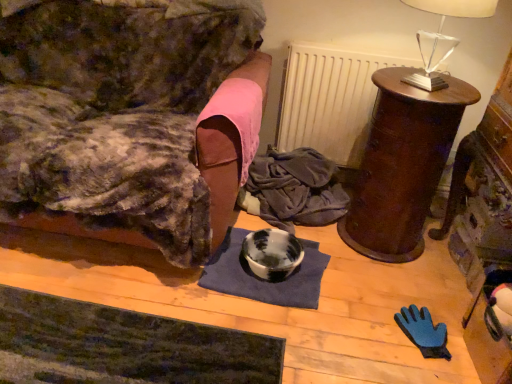
This screenshot has width=512, height=384. Find the location of `vacant region below marbled ceramic bowl at center (from a real-world perspective)`. vacant region below marbled ceramic bowl at center (from a real-world perspective) is located at coordinates (283, 272).